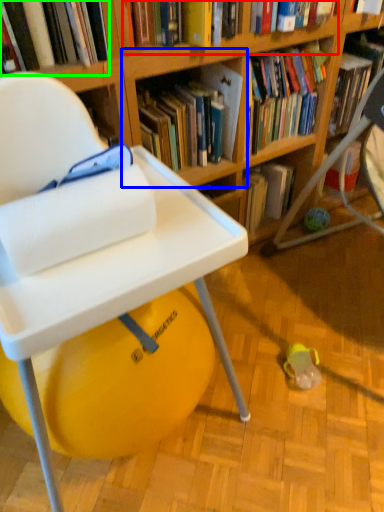
Question: Based on their relative distances, which object is farther from book (highlighted by a red box)? Choose from shelf (highlighted by a blue box) and book (highlighted by a green box).

Choices:
 (A) shelf
 (B) book

Answer: (B)